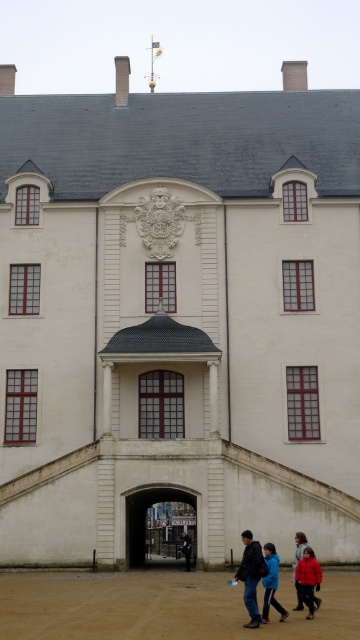
You are standing in front of the historical building and see the dark blue jeans at lower center and the red matte jacket at lower right. Which object is nearer to you?

The dark blue jeans at lower center is closer to the viewer than the red matte jacket at lower right.

You are an interior designer observing the grand historical building. You notice two jackets displayed near the entrance. The red matte jacket at lower right and the blue fabric jacket at lower center. Which jacket is positioned higher relative to the other?

The red matte jacket at lower right is above the blue fabric jacket at lower center, so it is positioned higher.

You are standing in front of the grand historical building and want to take a photo. You notice two points marked on the facade. The first point is at coordinate point (x=295, y=577) and the second is at point (x=266, y=579). Which point is closer to your camera when taking the photo?

Point (x=266, y=579) is closer to the camera than point (x=295, y=577) because the first point is further away from the camera compared to the second one.